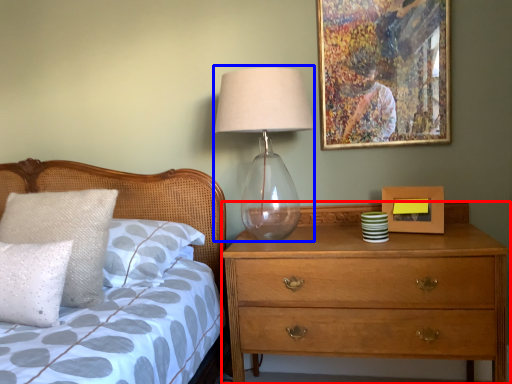
Question: Which point is further to the camera, chest of drawers (highlighted by a red box) or table lamp (highlighted by a blue box)?

Choices:
 (A) chest of drawers
 (B) table lamp

Answer: (B)